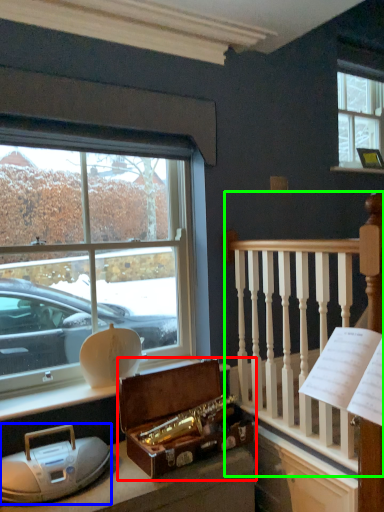
Question: Which object is positioned farthest from box (highlighted by a red box)? Select from artifact (highlighted by a blue box) and rail (highlighted by a green box).

Choices:
 (A) artifact
 (B) rail

Answer: (B)